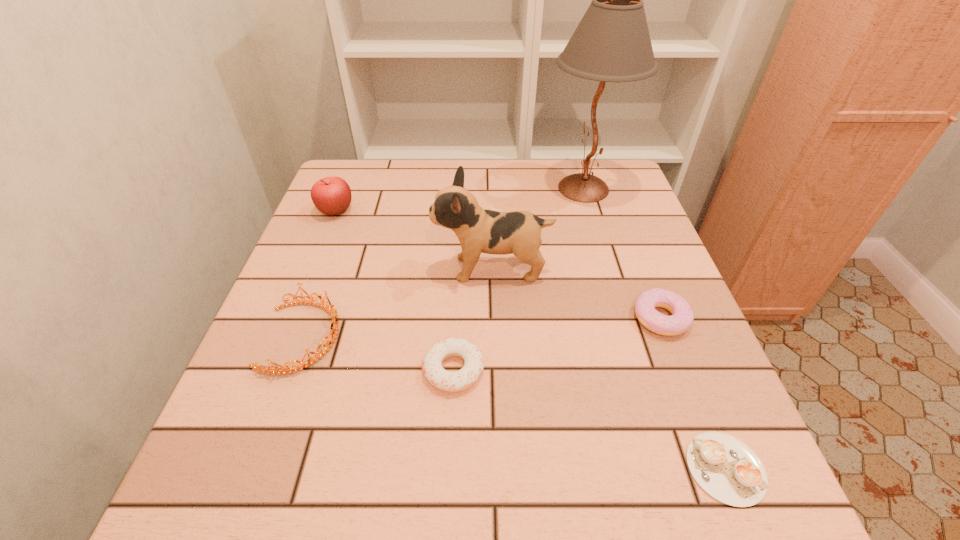
Identify the location of vacant space that satisfies the following two spatial constraints: 1. on the front-facing side of the tiara; 2. on the right side of the left doughnut. (291, 370).

The height and width of the screenshot is (540, 960). Find the location of `vacant region that satisfies the following two spatial constraints: 1. on the front side of the fifth shortest object; 2. on the right side of the nearest object`. vacant region that satisfies the following two spatial constraints: 1. on the front side of the fifth shortest object; 2. on the right side of the nearest object is located at coordinates (233, 468).

The image size is (960, 540). In order to click on blank area in the image that satisfies the following two spatial constraints: 1. on the front-facing side of the tiara; 2. on the left side of the nearer doughnut in this screenshot , I will do `click(291, 370)`.

Image resolution: width=960 pixels, height=540 pixels. In order to click on vacant area in the image that satisfies the following two spatial constraints: 1. at the face of the second tallest object; 2. on the left side of the cappuccino in this screenshot , I will do `click(497, 468)`.

Where is `vacant space that satisfies the following two spatial constraints: 1. at the face of the sixth shortest object; 2. on the back side of the right doughnut`? vacant space that satisfies the following two spatial constraints: 1. at the face of the sixth shortest object; 2. on the back side of the right doughnut is located at coordinates (493, 318).

At what (x,y) coordinates should I click in order to perform the action: click on free space that satisfies the following two spatial constraints: 1. on the front-facing side of the shortest object; 2. on the left side of the tallest object. Please return your answer as a coordinate pair (x, y). The height and width of the screenshot is (540, 960). Looking at the image, I should click on (669, 468).

Identify the location of vacant region that satisfies the following two spatial constraints: 1. on the front-facing side of the nearer doughnut; 2. on the left side of the fourth tallest object. (x=291, y=370).